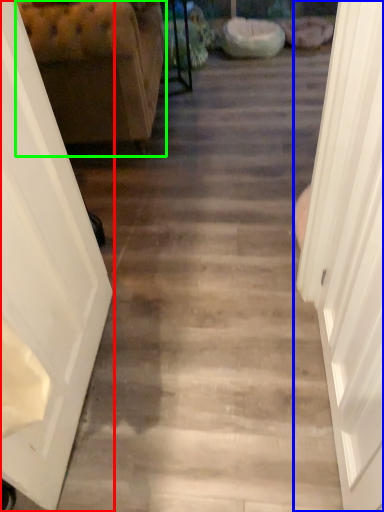
Question: Considering the real-world distances, which object is farthest from door (highlighted by a red box)? door (highlighted by a blue box) or furniture (highlighted by a green box)?

Choices:
 (A) door
 (B) furniture

Answer: (B)